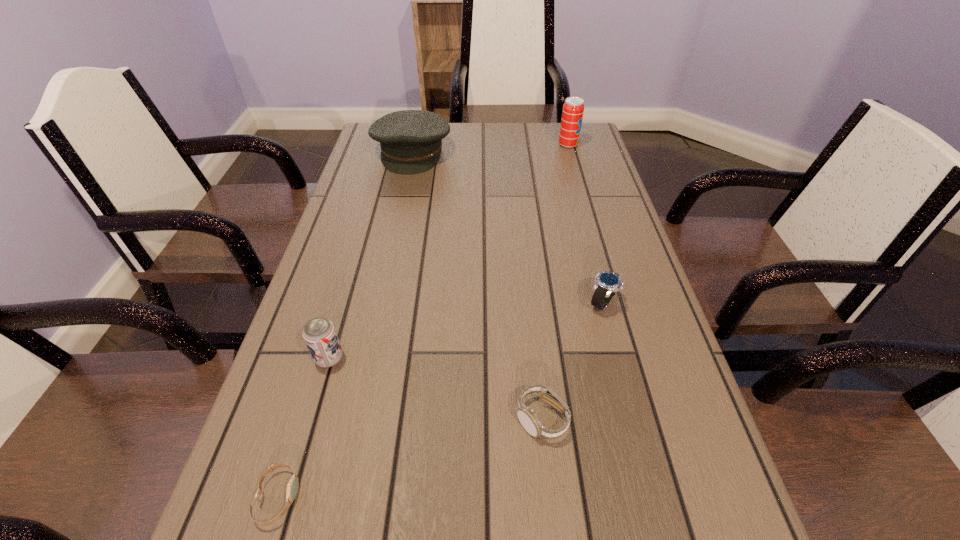
Where is `vacant space situated 0.280m on the left of the soda can`? The height and width of the screenshot is (540, 960). vacant space situated 0.280m on the left of the soda can is located at coordinates (472, 145).

This screenshot has height=540, width=960. Identify the location of vacant position located on the front-facing side of the second tallest object. (387, 268).

In order to click on vacant space located 0.120m on the back of the beer can in this screenshot , I will do `click(346, 301)`.

Locate an element on the screen. free region located 0.130m on the back of the tallest watch is located at coordinates (588, 251).

Find the location of a particular element. blank space located 0.260m on the face of the leftmost watch is located at coordinates (467, 497).

Where is `soda can that is positioned at the far edge`? The image size is (960, 540). soda can that is positioned at the far edge is located at coordinates (573, 109).

The image size is (960, 540). I want to click on beret that is at the far edge, so click(x=411, y=140).

The image size is (960, 540). What are the coordinates of `beret at the left edge` in the screenshot? It's located at (411, 140).

The image size is (960, 540). I want to click on beer can present at the left edge, so tap(319, 333).

You are a GUI agent. You are given a task and a screenshot of the screen. Output one action in this format:
    pyautogui.click(x=<x>, y=<y>)
    Task: Click on the watch present at the left edge
    
    Given the screenshot: What is the action you would take?
    pyautogui.click(x=292, y=487)